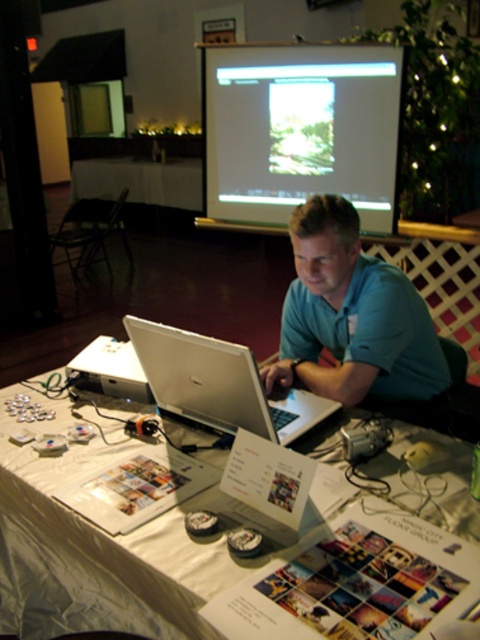
You are setting up for a presentation and need to adjust the projector. Since the white plastic projector at lower left is behind the matte silver laptop at upper center, can you move the laptop to access the projector?

The white plastic projector at lower left is behind the matte silver laptop at upper center, so you can move the matte silver laptop at upper center to access the projector by pulling it forward.

You are organizing a conference and need to place a name tag on the table. The name tag is small and needs to be placed between the matte silver laptop at upper center and the silver metallic laptop at center. Is there enough space between them to place the name tag?

The matte silver laptop at upper center is located above the silver metallic laptop at center, so there is vertical space between them. However, since both laptops are on the same table surface, the horizontal distance between them would determine if the name tag fits. Without specific measurements, it is uncertain if the space is sufficient. Please check the horizontal gap between them.